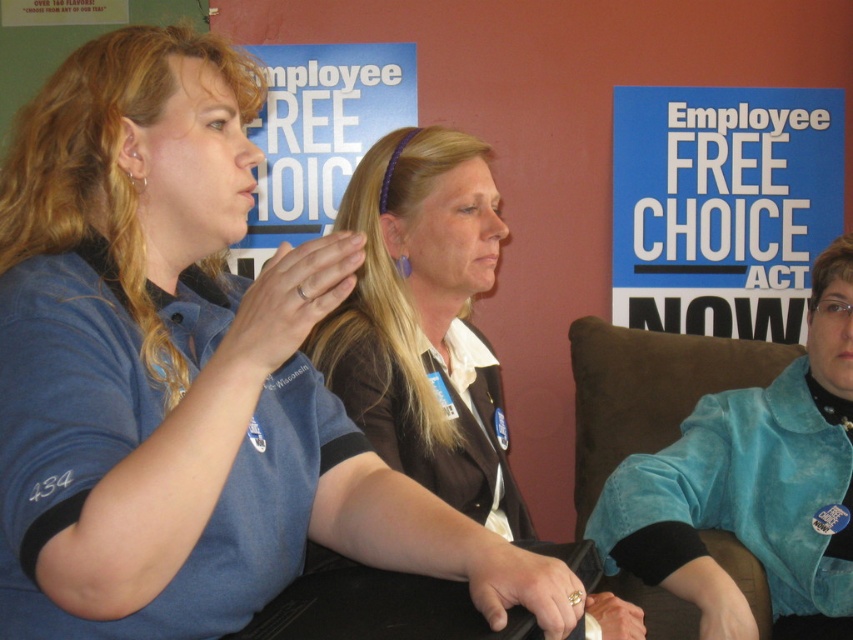
Based on the scene description, where is the brown suede chair at right located in relation to the blue fabric poster at center?

The brown suede chair at right is located to the right of the blue fabric poster at center.